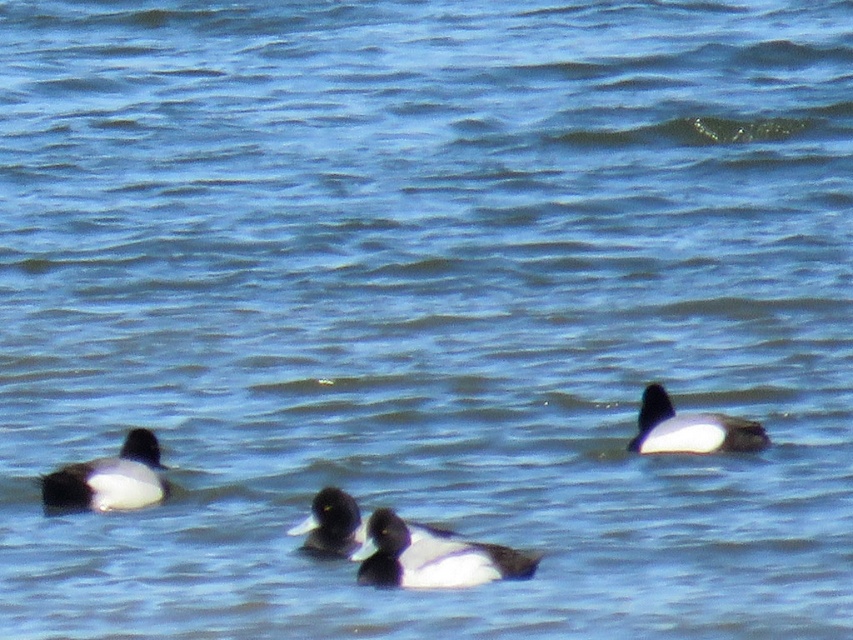
Looking at this image, is white matte duck at right behind white matte duck at center?

Yes, white matte duck at right is further from the viewer.

Between point (711, 413) and point (328, 492), which one is positioned in front?

Point (328, 492)

Does point (724, 438) come behind point (317, 513)?

Yes, it is.

Where is `white matte duck at right`? The height and width of the screenshot is (640, 853). white matte duck at right is located at coordinates (689, 428).

I want to click on black matte duck at center, so click(432, 557).

Who is lower down, black matte duck at center or white matte duck at left?

black matte duck at center

Describe the element at coordinates (432, 557) in the screenshot. This screenshot has height=640, width=853. I see `black matte duck at center` at that location.

Find the location of a particular element. black matte duck at center is located at coordinates (432, 557).

Does black matte duck at center appear on the left side of white matte duck at center?

Incorrect, black matte duck at center is not on the left side of white matte duck at center.

Describe the element at coordinates (432, 557) in the screenshot. I see `black matte duck at center` at that location.

Does point (489, 570) lie in front of point (352, 515)?

Yes, it is in front of point (352, 515).

Locate an element on the screen. This screenshot has width=853, height=640. black matte duck at center is located at coordinates (432, 557).